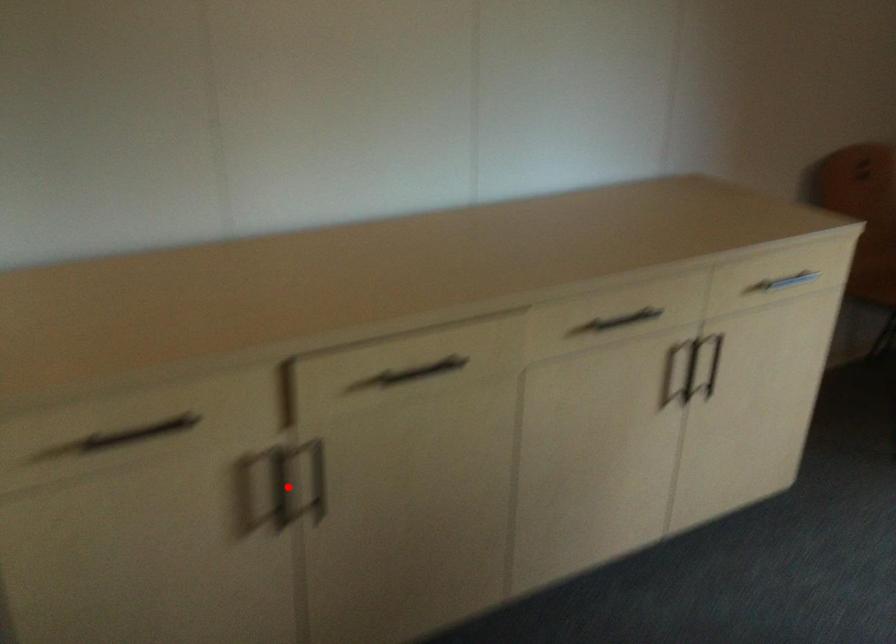
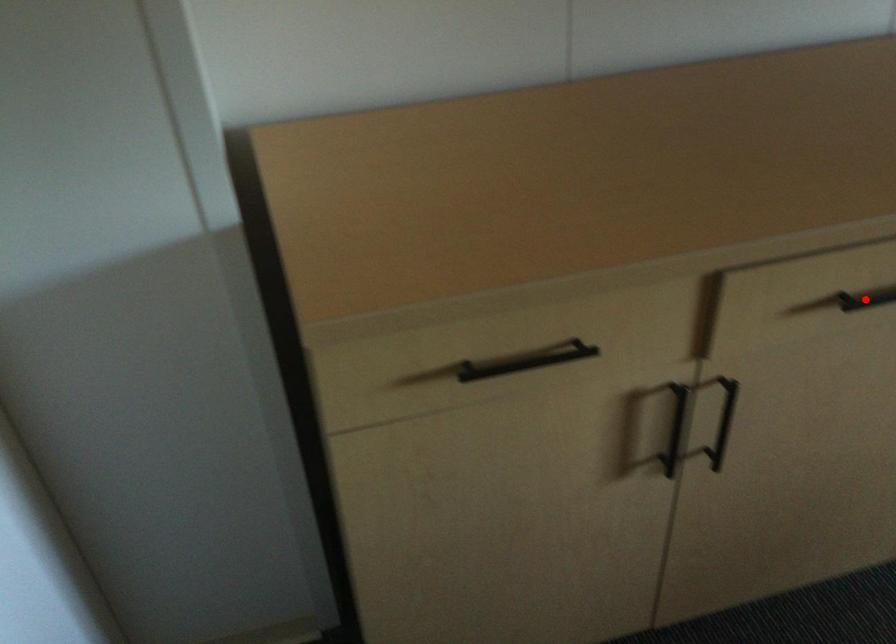
I am providing you with two images of the same scene from different viewpoints. A red point is marked on the first image and another point is marked on the second image. Are the points marked in image1 and image2 representing the same 3D position?

No